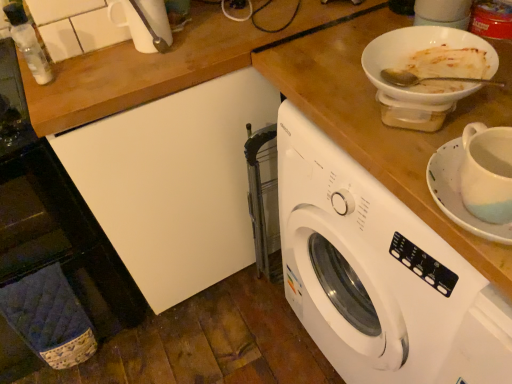
Find the location of a particular element. free space in front of transparent plastic bottle at upper left is located at coordinates (52, 86).